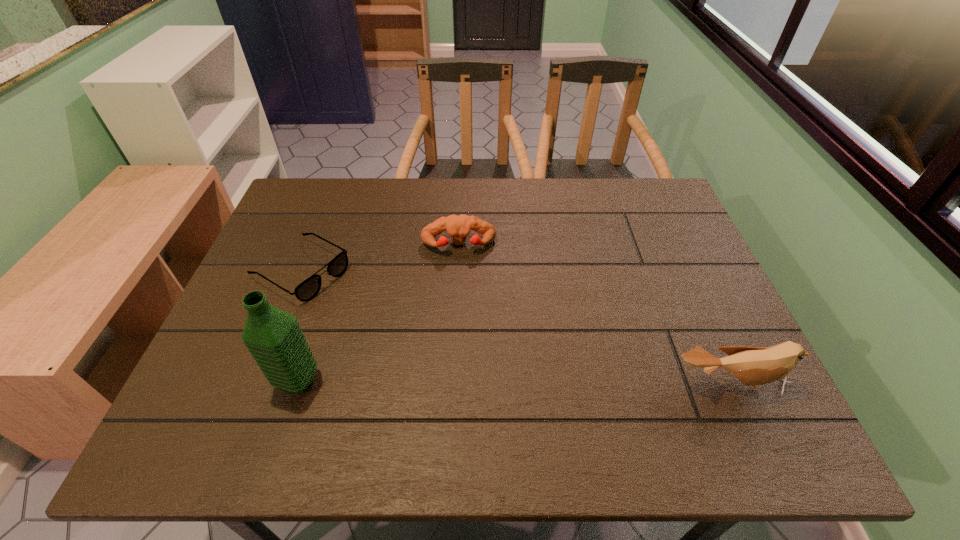
The image size is (960, 540). I want to click on the tallest object, so click(274, 338).

You are a GUI agent. You are given a task and a screenshot of the screen. Output one action in this format:
    pyautogui.click(x=<x>, y=<y>)
    Task: Click on the bird
    This screenshot has width=960, height=540.
    Given the screenshot: What is the action you would take?
    pyautogui.click(x=753, y=366)

Find the location of a particular element. The height and width of the screenshot is (540, 960). the rightmost object is located at coordinates (753, 366).

I want to click on the shortest object, so click(308, 289).

The image size is (960, 540). Find the location of `the third object from left to right`. the third object from left to right is located at coordinates (458, 227).

Where is `puncher`? puncher is located at coordinates (458, 227).

Locate an element on the screen. This screenshot has width=960, height=540. free point located on the right of the tallest object is located at coordinates (497, 380).

The height and width of the screenshot is (540, 960). Find the location of `vacant region located on the front-facing side of the shortest object`. vacant region located on the front-facing side of the shortest object is located at coordinates (461, 362).

Image resolution: width=960 pixels, height=540 pixels. In order to click on vacant space located on the front-facing side of the shortest object in this screenshot , I will do `click(370, 309)`.

You are a GUI agent. You are given a task and a screenshot of the screen. Output one action in this format:
    pyautogui.click(x=<x>, y=<y>)
    Task: Click on the free space located on the front-facing side of the shortest object
    This screenshot has width=960, height=540.
    Given the screenshot: What is the action you would take?
    pyautogui.click(x=389, y=320)